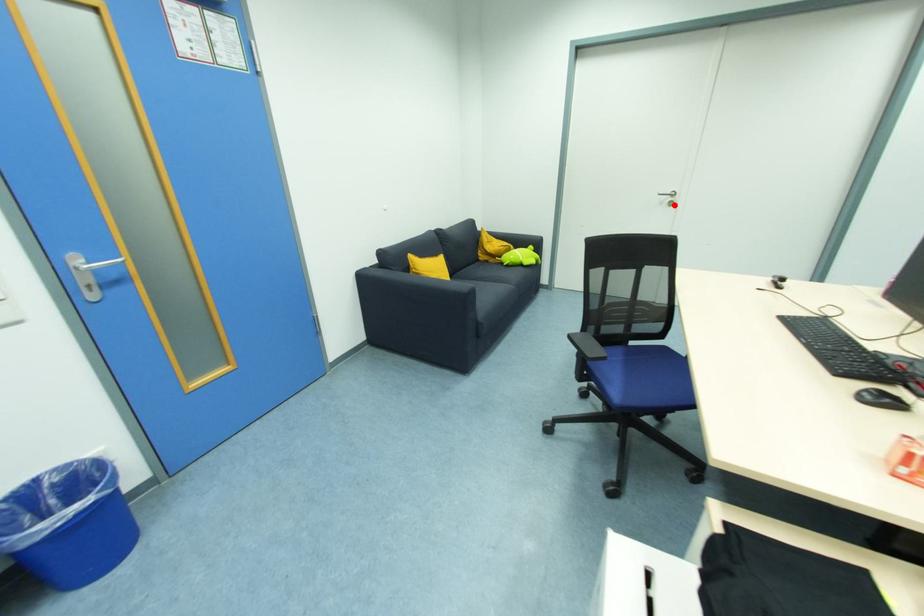
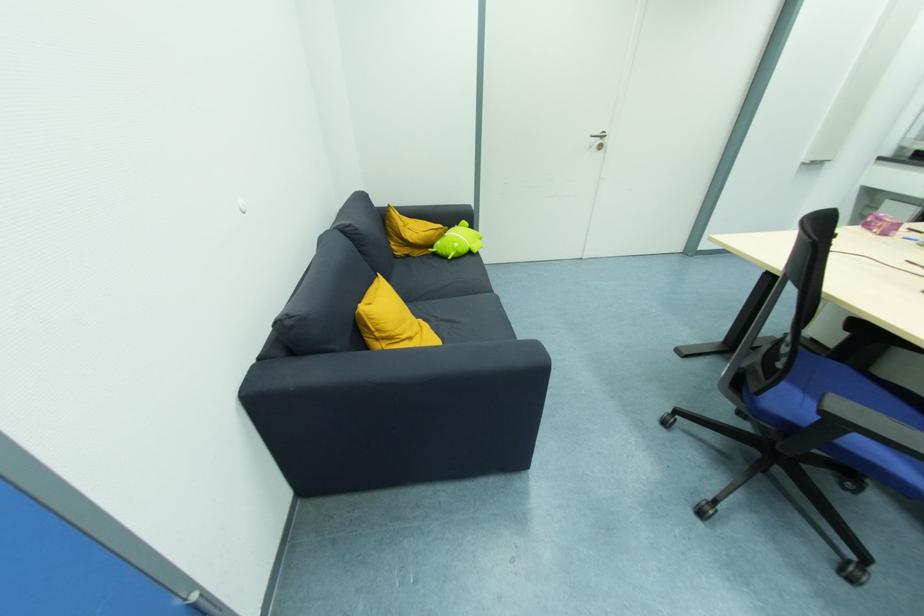
Where in the second image is the point corresponding to the highlighted location from the first image?

(603, 148)